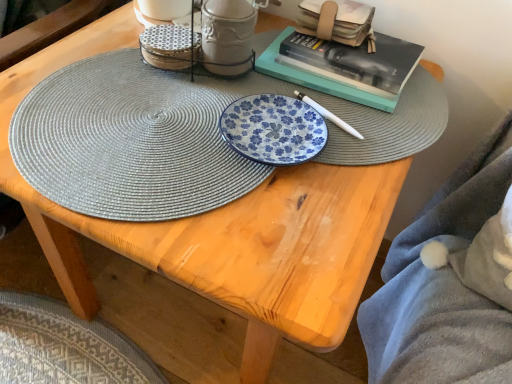
Locate an element on the screen. vacant area situated below matte gray woven placemat at center (from a real-world perspective) is located at coordinates (149, 137).